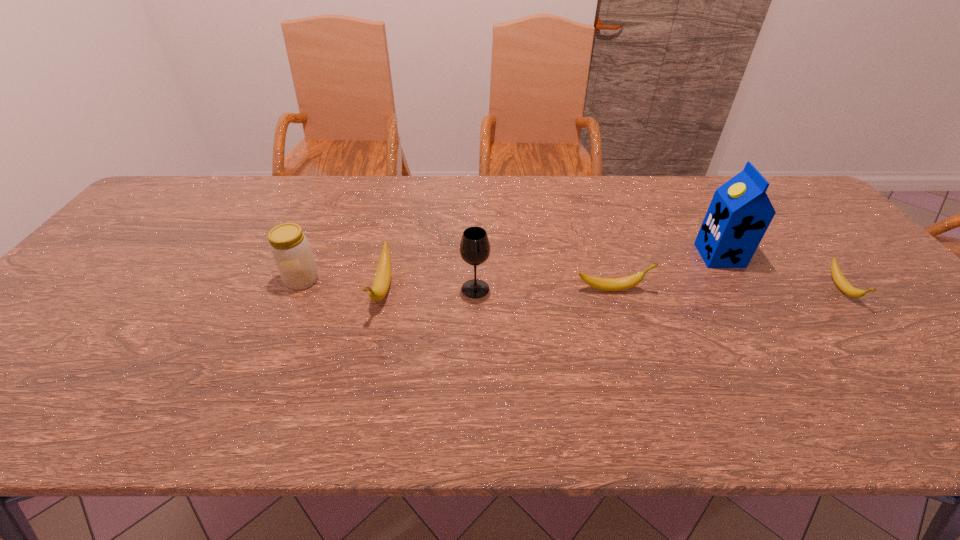
Locate an element on the screen. vacant space located at the stem of the fifth object from right to left is located at coordinates (367, 360).

Locate an element on the screen. The height and width of the screenshot is (540, 960). vacant area situated at the stem of the second shortest object is located at coordinates (680, 289).

Where is `vacant space located 0.080m at the stem of the shortest banana`? vacant space located 0.080m at the stem of the shortest banana is located at coordinates (882, 337).

Identify the location of vacant space located 0.110m on the left of the wineglass. (418, 289).

Locate an element on the screen. The height and width of the screenshot is (540, 960). free space located on the left of the leftmost object is located at coordinates (139, 280).

Image resolution: width=960 pixels, height=540 pixels. What are the coordinates of `vacant space located 0.170m with the cap open on the second object from right to left` in the screenshot? It's located at (638, 255).

What are the coordinates of `vacant space located 0.350m with the cap open on the second object from right to left` in the screenshot? It's located at (574, 255).

At what (x,y) coordinates should I click in order to perform the action: click on free space located 0.320m with the cap open on the second object from right to left. Please return your answer as a coordinate pair (x, y). Looking at the image, I should click on (585, 255).

I want to click on object at the right edge, so click(x=842, y=283).

The width and height of the screenshot is (960, 540). Identify the location of free region at the far edge of the desktop. (223, 207).